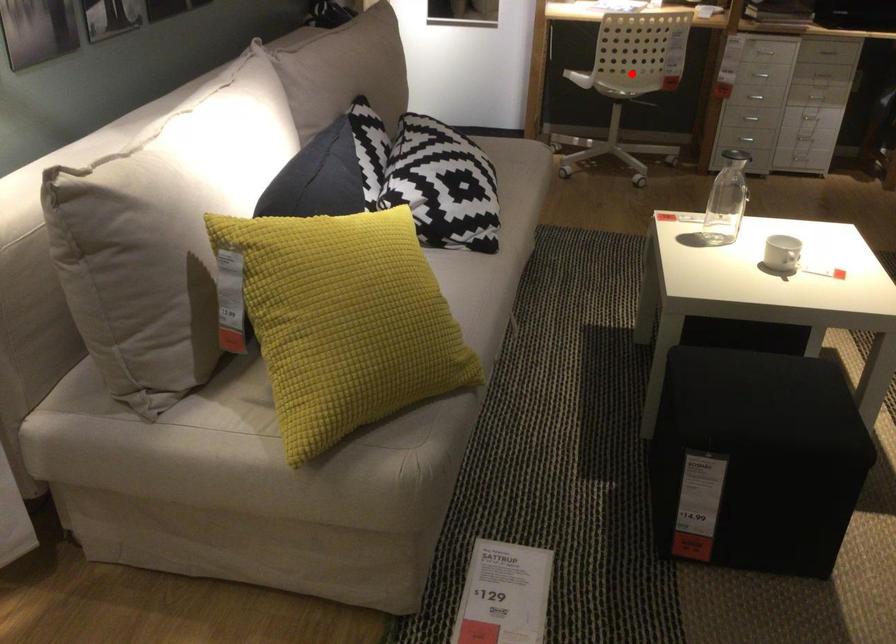
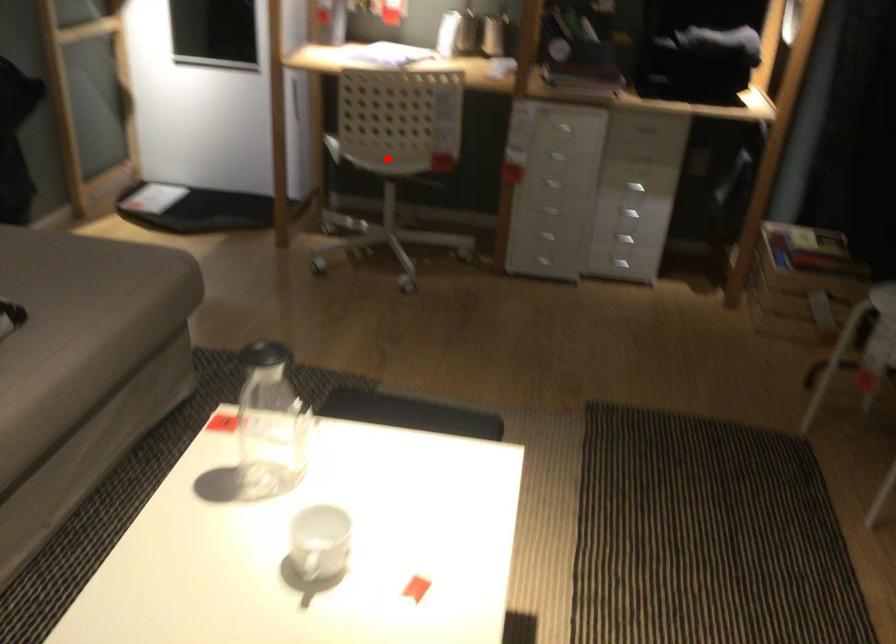
I am providing you with two images of the same scene from different viewpoints. A red point is marked on the first image and another point is marked on the second image. Is the red point in image1 aligned with the point shown in image2?

Yes